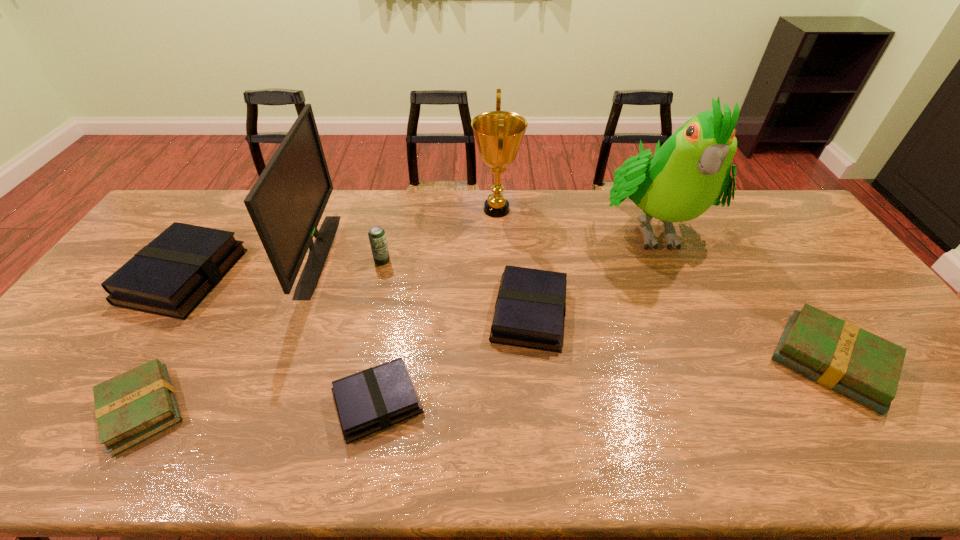
I want to click on free spot at the far edge of the desktop, so click(375, 192).

Where is `free space at the near edge of the desktop`? Image resolution: width=960 pixels, height=540 pixels. free space at the near edge of the desktop is located at coordinates (784, 455).

You are a GUI agent. You are given a task and a screenshot of the screen. Output one action in this format:
    pyautogui.click(x=<x>, y=<y>)
    Task: Click on the free location at the far left corner of the desktop
    
    Given the screenshot: What is the action you would take?
    pyautogui.click(x=203, y=211)

Identify the location of vacant space at the far right corner of the desktop. The image size is (960, 540). (763, 221).

Identify the location of free area in between the monitor and the parakeet. (485, 241).

Where is `vacant space that's between the leftmost blue book and the smaller yellow book`? vacant space that's between the leftmost blue book and the smaller yellow book is located at coordinates click(x=163, y=342).

The width and height of the screenshot is (960, 540). What are the coordinates of `vacant area that lies between the seventh object from right to left and the third book from left to right` in the screenshot? It's located at (348, 328).

Locate an element on the screen. The height and width of the screenshot is (540, 960). free area in between the second smallest blue book and the second blue book from right to left is located at coordinates (453, 357).

I want to click on vacant space in between the fifth shortest object and the smaller yellow book, so click(163, 342).

Identify the location of free space between the nearest blue book and the second book from right to left. (453, 357).